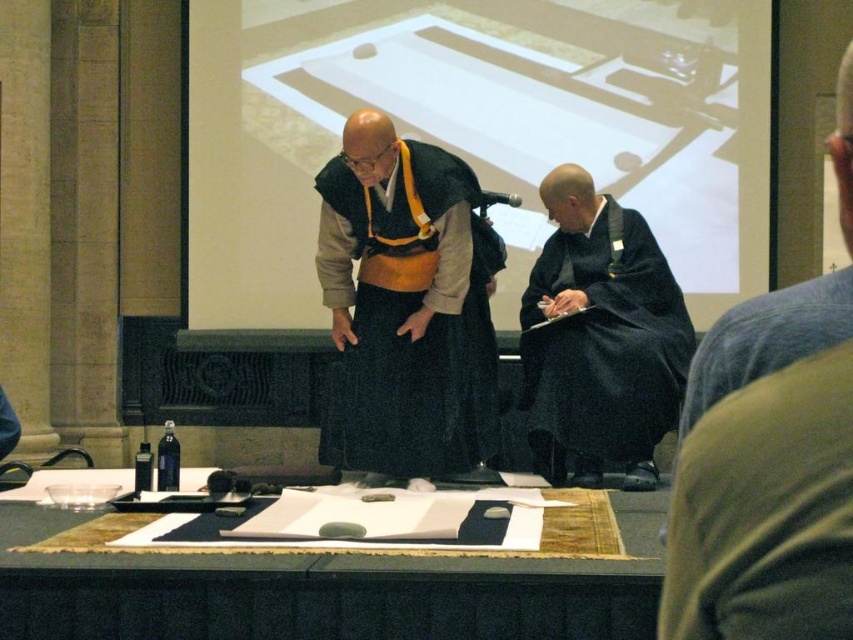
You are attending a lecture and need to place a notebook on the smooth wooden table at center. However, there is a dark blue silk robe at lower right nearby. Will the robe interfere with placing the notebook on the table?

The smooth wooden table at center is located below the dark blue silk robe at lower right, so the robe is positioned above the table. This means the robe will not interfere with placing the notebook on the table as it is above and not on the table itself.

Looking at this image, you are an attendee at this event and want to see both the dark blue robe at center and the smooth wooden table at center clearly. Which one is closer to you?

The dark blue robe at center is closer to you because it is in front of the smooth wooden table at center.